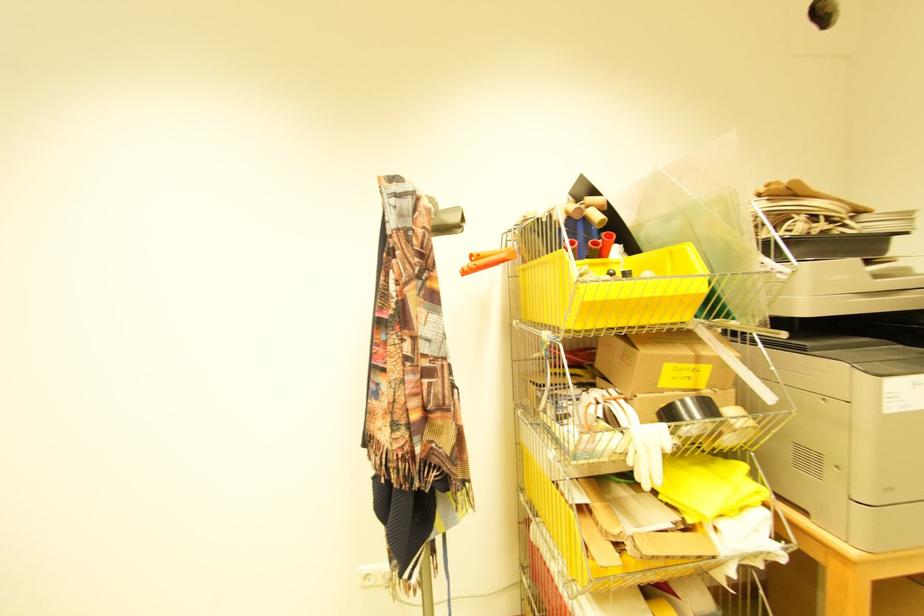
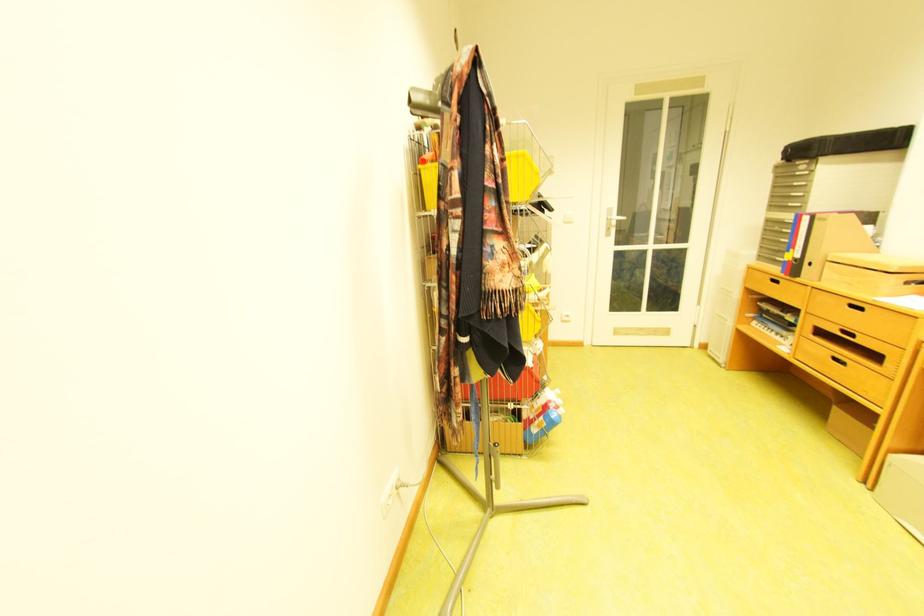
Find the pixel in the second image that matches the point at 423,334 in the first image.

(518, 201)